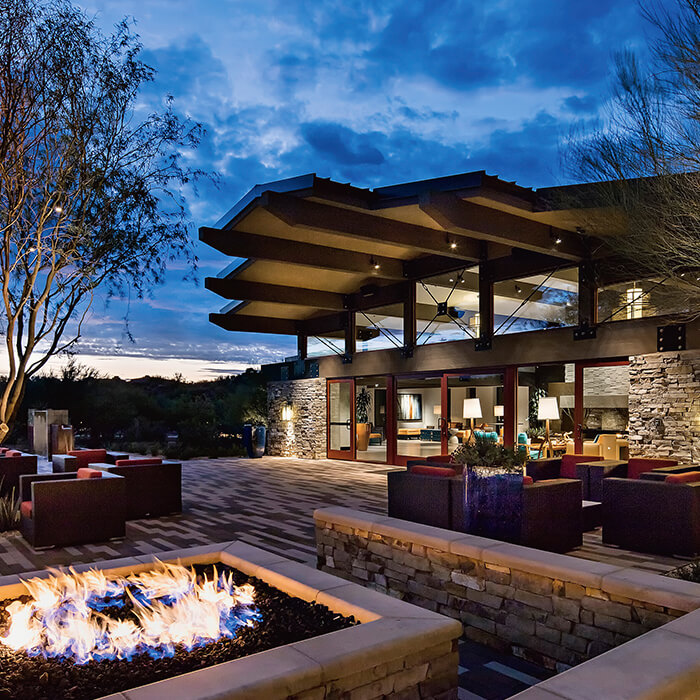
Image resolution: width=700 pixels, height=700 pixels. What are the coordinates of `chairs` in the screenshot? It's located at (622, 505), (545, 511), (430, 505), (628, 465), (567, 466), (62, 498), (132, 477), (87, 456), (14, 452).